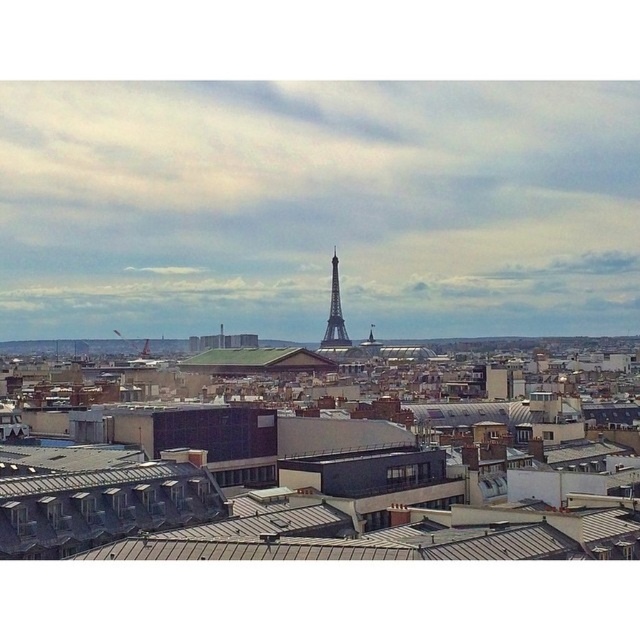
Question: Is gray metallic roof at center to the left of shiny metallic eiffel tower at center from the viewer's perspective?

Choices:
 (A) yes
 (B) no

Answer: (A)

Question: Does gray metallic roof at center come behind shiny metallic eiffel tower at center?

Choices:
 (A) no
 (B) yes

Answer: (A)

Question: Does gray metallic roof at center have a larger size compared to shiny metallic eiffel tower at center?

Choices:
 (A) no
 (B) yes

Answer: (B)

Question: Which object is closer to the camera taking this photo?

Choices:
 (A) gray metallic roof at center
 (B) shiny metallic eiffel tower at center

Answer: (A)

Question: Which point is farther to the camera?

Choices:
 (A) gray metallic roof at center
 (B) shiny metallic eiffel tower at center

Answer: (B)